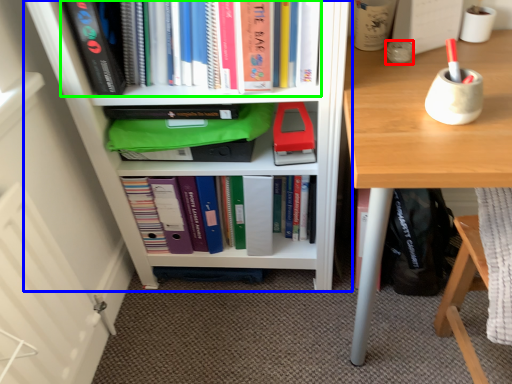
Question: Which object is positioned farthest from stationery (highlighted by a red box)? Select from bookcase (highlighted by a blue box) and book (highlighted by a green box).

Choices:
 (A) bookcase
 (B) book

Answer: (A)